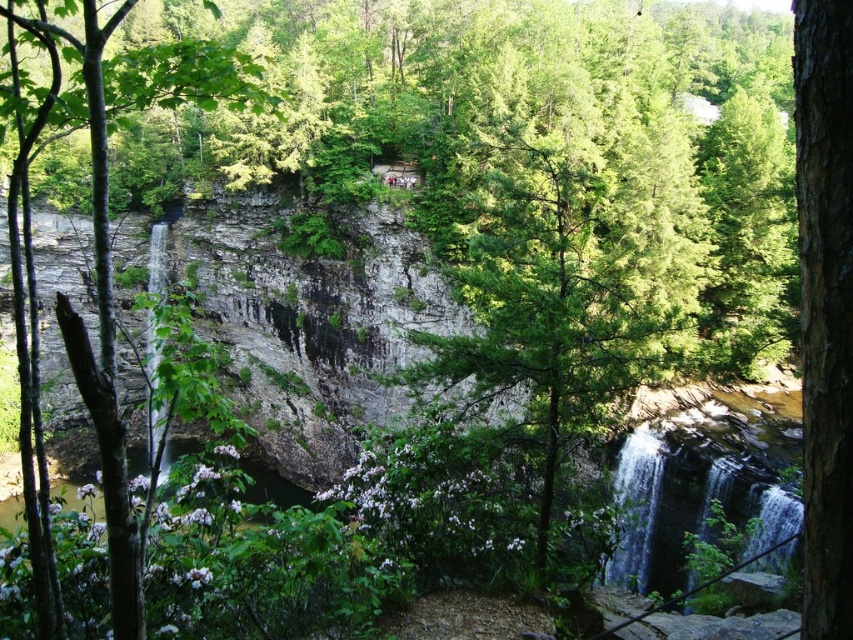
Question: Is green textured tree at center below brown rough bark tree at center-left?

Choices:
 (A) no
 (B) yes

Answer: (A)

Question: Which of the following is the farthest from the observer?

Choices:
 (A) (219, 54)
 (B) (801, 604)

Answer: (B)

Question: Is green textured tree at center closer to the viewer compared to green leafy tree at center?

Choices:
 (A) yes
 (B) no

Answer: (B)

Question: Among these objects, which one is farthest from the camera?

Choices:
 (A) brown rough bark tree at center-left
 (B) green textured tree at center

Answer: (B)

Question: Which point appears farthest from the camera in this image?

Choices:
 (A) (601, 349)
 (B) (822, 616)
 (C) (115, 552)

Answer: (A)

Question: Does green textured tree at center have a greater width compared to brown rough bark tree at center-left?

Choices:
 (A) yes
 (B) no

Answer: (A)